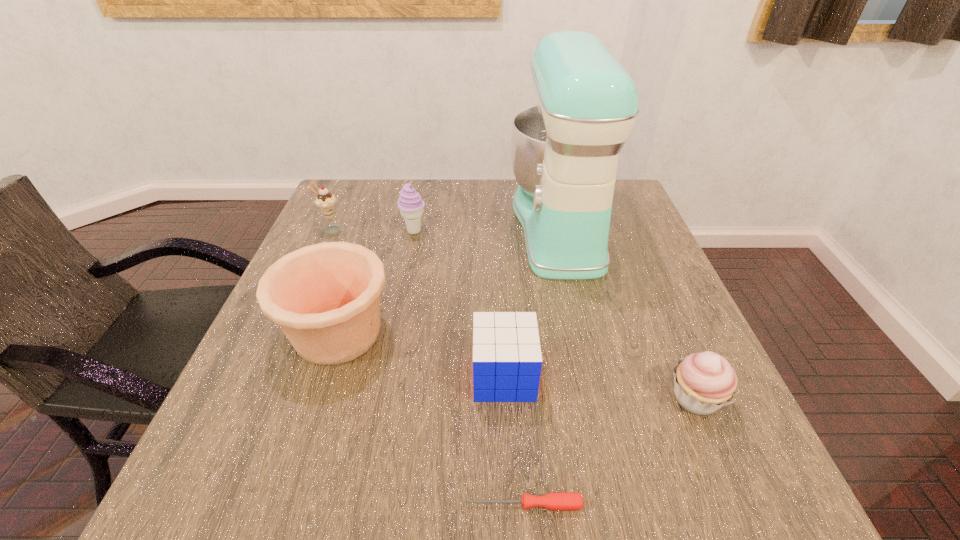
This screenshot has height=540, width=960. What are the coordinates of `vacant space at the near left corner of the desktop` in the screenshot? It's located at (213, 473).

Identify the location of vacant space at the near right corner of the desktop. The height and width of the screenshot is (540, 960). (710, 466).

This screenshot has height=540, width=960. Find the location of `empty space that is in between the left icecream and the cube`. empty space that is in between the left icecream and the cube is located at coordinates (418, 303).

The image size is (960, 540). I want to click on vacant area that lies between the cube and the right icecream, so click(x=459, y=303).

Find the location of a particular element. The image size is (960, 540). vacant space that's between the mixer and the cube is located at coordinates (531, 301).

Identify the location of free space between the left icecream and the right icecream. (372, 231).

Image resolution: width=960 pixels, height=540 pixels. What are the coordinates of `vacant region between the shortest object and the cupcake` in the screenshot? It's located at (610, 451).

Find the location of a particular element. This screenshot has height=540, width=960. free point between the cupcake and the right icecream is located at coordinates (555, 315).

Where is `blank region between the pottery and the screwdriver`? This screenshot has width=960, height=540. blank region between the pottery and the screwdriver is located at coordinates (431, 418).

Locate an element on the screen. free spot between the cupcake and the tallest object is located at coordinates (627, 312).